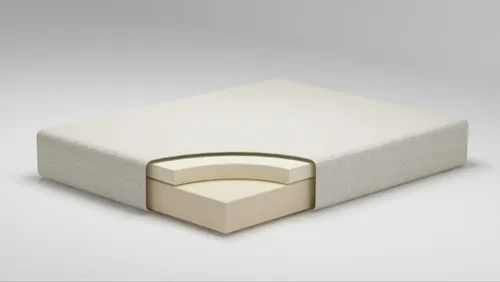
Identify the location of furniture. (356, 169).